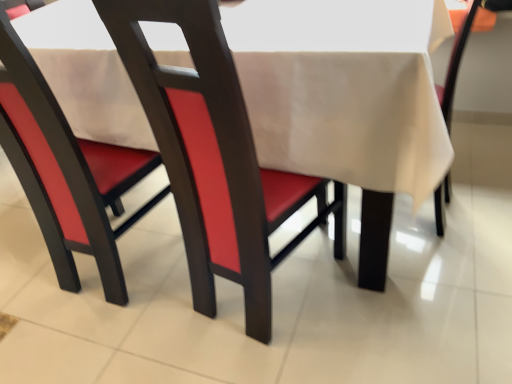
Where is `vacant area in front of matte red chair at center, arranged as the 3th chair when viewed from the right`? The height and width of the screenshot is (384, 512). vacant area in front of matte red chair at center, arranged as the 3th chair when viewed from the right is located at coordinates (109, 334).